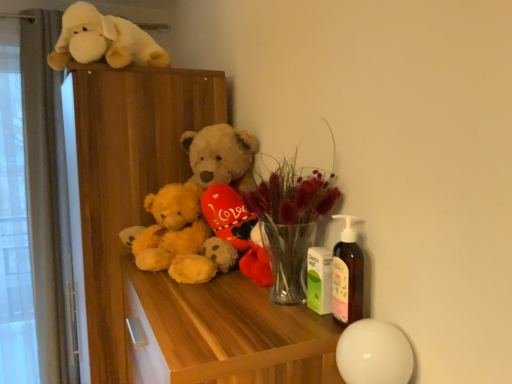
Where is `free spot to the left of green matte lotion bottle at center, the 2th toy positioned from the back`? free spot to the left of green matte lotion bottle at center, the 2th toy positioned from the back is located at coordinates (257, 322).